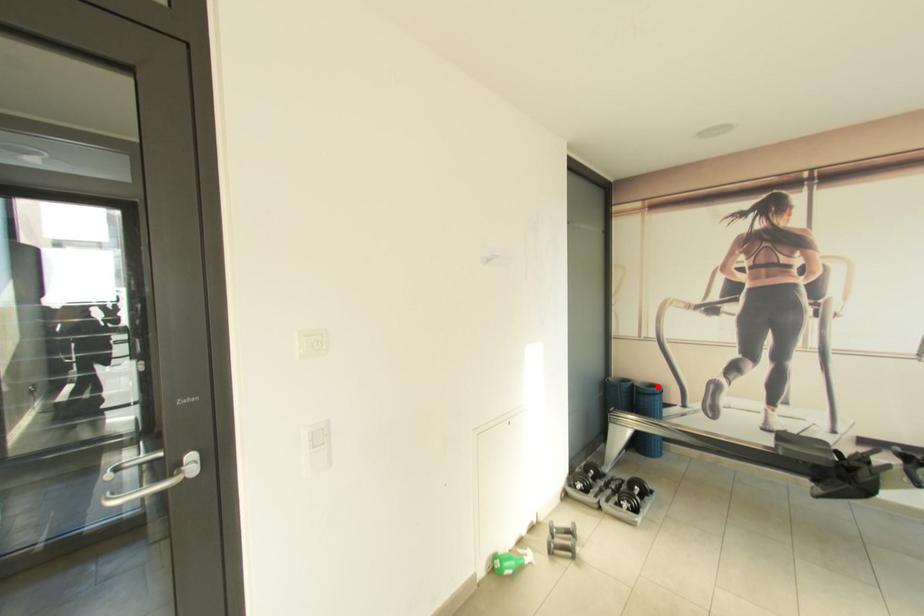
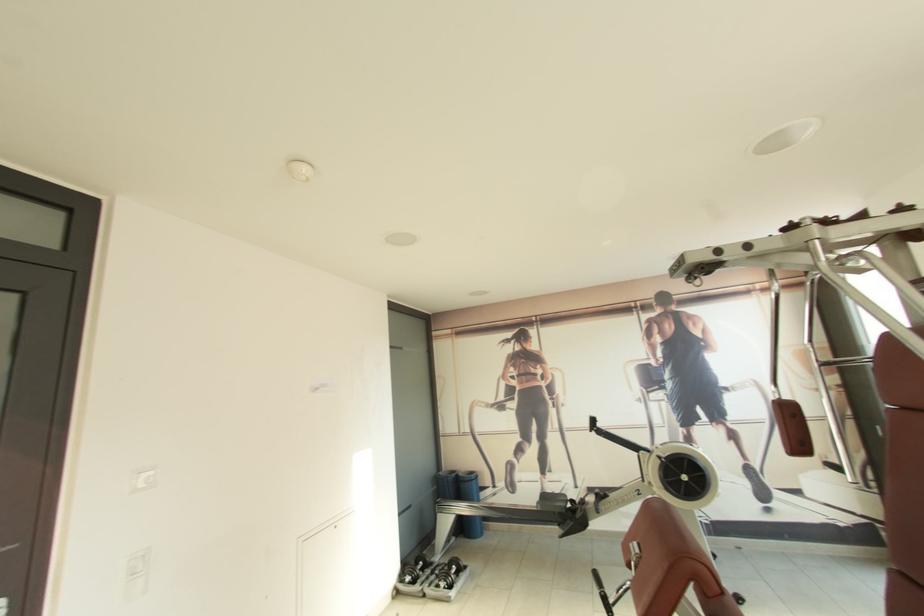
Question: I am providing you with two images of the same scene from different viewpoints. Image1 has a red point marked. In image2, the corresponding 3D location appears at what relative position? Reply with the corresponding letter.

Choices:
 (A) Closer
 (B) Farther

Answer: (B)